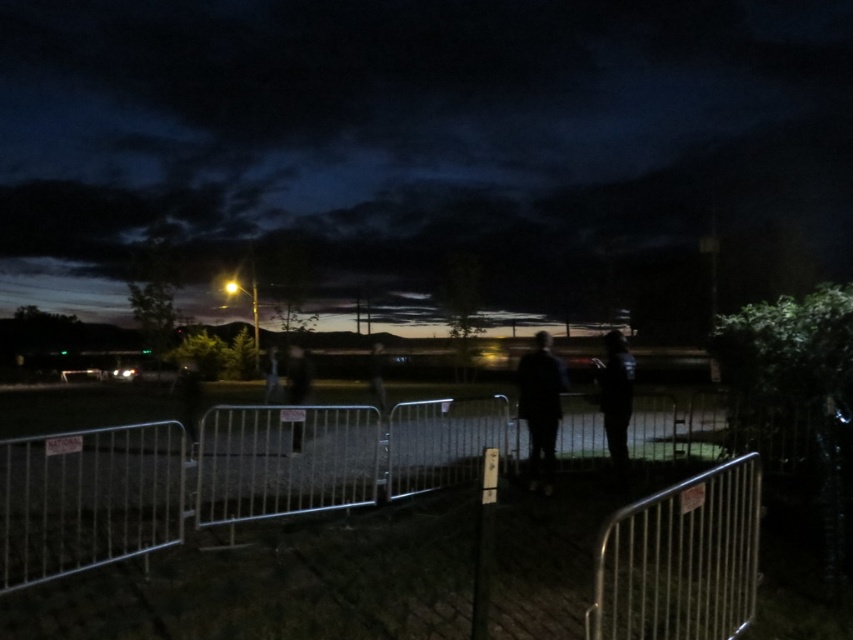
Which is in front, point (709, 506) or point (532, 477)?

Positioned in front is point (709, 506).

Who is lower down, metallic silver barricade at center or dark fabric jacket at center?

metallic silver barricade at center is lower down.

Describe the element at coordinates (680, 560) in the screenshot. I see `metallic silver barricade at center` at that location.

The image size is (853, 640). In order to click on metallic silver barricade at center in this screenshot , I will do `click(680, 560)`.

Is point (689, 586) positioned after point (605, 419)?

No.

Between point (757, 529) and point (601, 397), which one is positioned behind?

Positioned behind is point (601, 397).

What do you see at coordinates (680, 560) in the screenshot?
I see `metallic silver barricade at center` at bounding box center [680, 560].

In order to click on metallic silver barricade at center in this screenshot , I will do `click(680, 560)`.

Can you confirm if dark fabric jacket at center is wider than dark blue fabric jacket at center?

No.

Does point (527, 388) come in front of point (631, 371)?

Yes, it is.

Find the location of a particular element. This screenshot has width=853, height=640. dark fabric jacket at center is located at coordinates (540, 406).